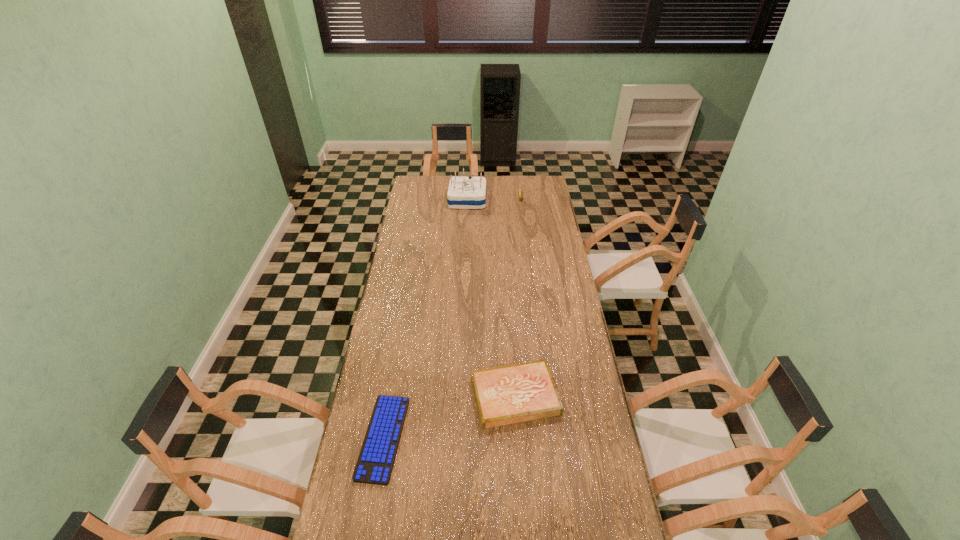
The image size is (960, 540). Identify the location of birthday cake. (463, 192).

You are a GUI agent. You are given a task and a screenshot of the screen. Output one action in this format:
    pyautogui.click(x=<x>, y=<y>)
    Task: Click on the third shortest object
    The width and height of the screenshot is (960, 540).
    Given the screenshot: What is the action you would take?
    pyautogui.click(x=520, y=191)

At what (x,y) coordinates should I click in order to perform the action: click on the third tallest object. Please return your answer as a coordinate pair (x, y). This screenshot has width=960, height=540. Looking at the image, I should click on (516, 393).

What are the coordinates of `the leftmost object` in the screenshot? It's located at (375, 463).

This screenshot has width=960, height=540. What are the coordinates of `the shortest object` in the screenshot? It's located at (375, 463).

You are a GUI agent. You are given a task and a screenshot of the screen. Output one action in this format:
    pyautogui.click(x=<x>, y=<y>)
    Task: Click on the free space located on the front of the tallest object
    This screenshot has width=960, height=540.
    Given the screenshot: What is the action you would take?
    pyautogui.click(x=466, y=244)

Locate an element on the screen. This screenshot has height=540, width=960. vacant space located 0.200m at the stem of the banana is located at coordinates (523, 221).

Find the location of a particular element. vacant space located on the left of the hardback book is located at coordinates click(443, 396).

You are a GUI agent. You are given a task and a screenshot of the screen. Output one action in this format:
    pyautogui.click(x=<x>, y=<y>)
    Task: Click on the vacant region located on the back of the leftmost object
    Image resolution: width=960 pixels, height=540 pixels.
    Given the screenshot: What is the action you would take?
    pyautogui.click(x=403, y=323)

Identify the location of birthday cake that is at the far edge. (463, 192).